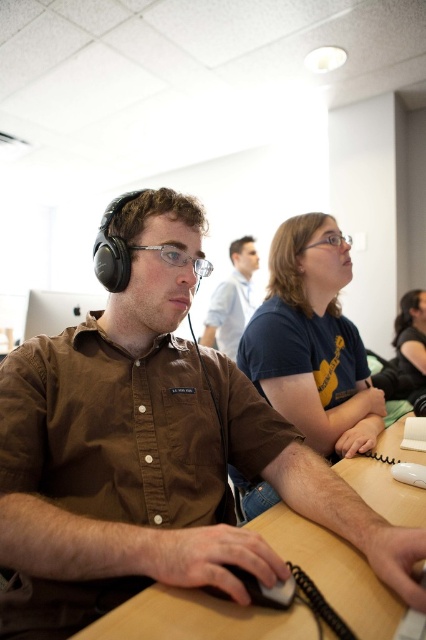
Question: Which object appears farthest from the camera in this image?

Choices:
 (A) black matte mouse at lower center
 (B) brown shirt at center

Answer: (A)

Question: Does brown shirt at center appear on the right side of wooden table at center?

Choices:
 (A) no
 (B) yes

Answer: (A)

Question: Among these points, which one is farthest from the camera?

Choices:
 (A) pyautogui.click(x=238, y=579)
 (B) pyautogui.click(x=403, y=480)

Answer: (B)

Question: Is brown shirt at center below silver metallic monitor at upper left?

Choices:
 (A) yes
 (B) no

Answer: (A)

Question: Where is brown shirt at center located in relation to silver metallic monitor at upper left in the image?

Choices:
 (A) right
 (B) left

Answer: (A)

Question: Which is farther from the white matte mouse at lower right?

Choices:
 (A) wooden table at center
 (B) matte brown shirt at center
 (C) silver metallic monitor at upper left

Answer: (B)